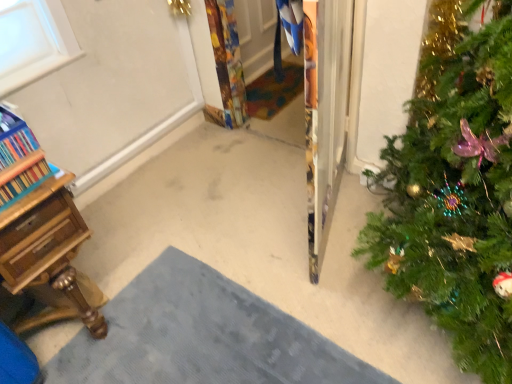
Question: From a real-world perspective, does wooden desk at lower left stand above gray textured doormat at lower center, the first doormat when ordered from bottom to top?

Choices:
 (A) yes
 (B) no

Answer: (A)

Question: Is wooden desk at lower left thinner than gray textured doormat at lower center, which ranks as the second doormat in back-to-front order?

Choices:
 (A) no
 (B) yes

Answer: (B)

Question: Is wooden desk at lower left oriented away from gray textured doormat at lower center, the 1th doormat when ordered from front to back?

Choices:
 (A) no
 (B) yes

Answer: (A)

Question: Is wooden desk at lower left further to camera compared to gray textured doormat at lower center, arranged as the second doormat when viewed from the top?

Choices:
 (A) no
 (B) yes

Answer: (B)

Question: Is gray textured doormat at lower center, arranged as the second doormat when viewed from the top, surrounded by wooden desk at lower left?

Choices:
 (A) no
 (B) yes

Answer: (A)

Question: Considering the relative sizes of wooden desk at lower left and gray textured doormat at lower center, the 1th doormat when ordered from front to back, in the image provided, is wooden desk at lower left smaller than gray textured doormat at lower center, the 1th doormat when ordered from front to back,?

Choices:
 (A) yes
 (B) no

Answer: (A)

Question: Is wooden desk at lower left beside wooden bookcase at left?

Choices:
 (A) no
 (B) yes

Answer: (A)

Question: Does wooden desk at lower left have a larger size compared to wooden bookcase at left?

Choices:
 (A) no
 (B) yes

Answer: (B)

Question: Can you confirm if wooden desk at lower left is positioned to the left of wooden bookcase at left?

Choices:
 (A) yes
 (B) no

Answer: (B)

Question: From a real-world perspective, does wooden desk at lower left sit lower than wooden bookcase at left?

Choices:
 (A) no
 (B) yes

Answer: (B)

Question: From a real-world perspective, is wooden desk at lower left positioned over wooden bookcase at left based on gravity?

Choices:
 (A) yes
 (B) no

Answer: (B)

Question: Is wooden desk at lower left taller than wooden bookcase at left?

Choices:
 (A) yes
 (B) no

Answer: (A)

Question: Can you confirm if green matte christmas tree at right is smaller than wooden desk at lower left?

Choices:
 (A) yes
 (B) no

Answer: (B)